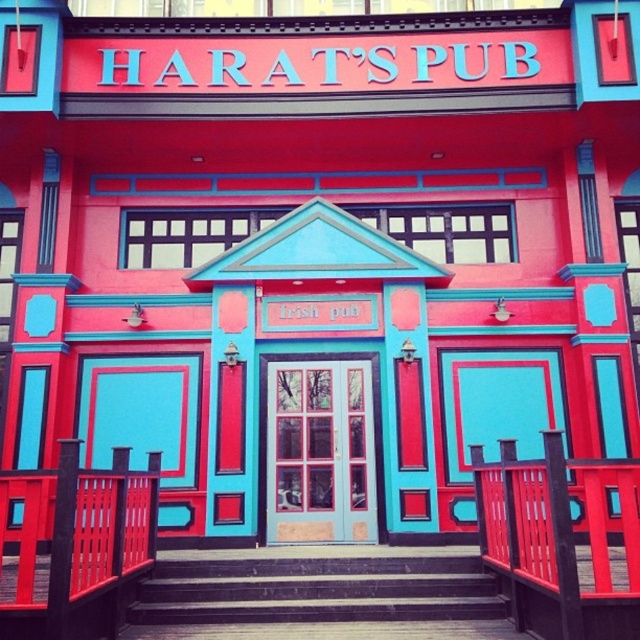
Question: Which of the following is the farthest from the observer?

Choices:
 (A) wooden textured rail at center
 (B) matte teal door at center

Answer: (B)

Question: Which is farther from the dark gray concrete stairs at center?

Choices:
 (A) matte teal door at center
 (B) wooden textured rail at center

Answer: (A)

Question: Is dark gray concrete stairs at center above matte teal door at center?

Choices:
 (A) no
 (B) yes

Answer: (A)

Question: From the image, what is the correct spatial relationship of dark gray concrete stairs at center in relation to matte teal door at center?

Choices:
 (A) right
 (B) left

Answer: (B)

Question: Does wooden textured rail at center appear on the left side of dark gray concrete stairs at center?

Choices:
 (A) yes
 (B) no

Answer: (B)

Question: Which point appears closest to the camera in this image?

Choices:
 (A) (372, 493)
 (B) (257, 588)
 (C) (499, 474)

Answer: (C)